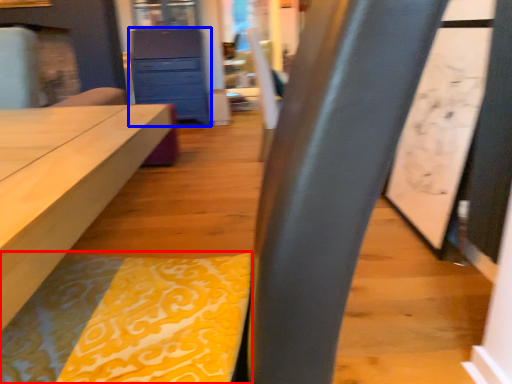
Question: Among these objects, which one is farthest to the camera, blanket (highlighted by a red box) or chest of drawers (highlighted by a blue box)?

Choices:
 (A) blanket
 (B) chest of drawers

Answer: (B)